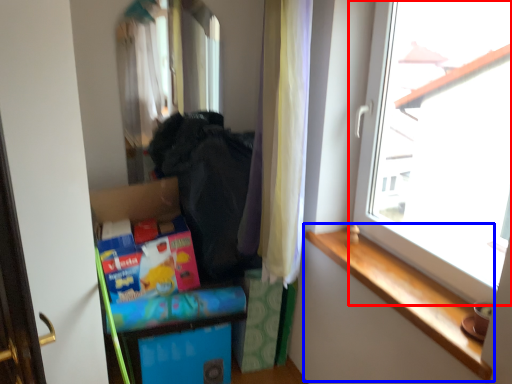
Question: Among these objects, which one is farthest to the camera, window (highlighted by a red box) or window sill (highlighted by a blue box)?

Choices:
 (A) window
 (B) window sill

Answer: (B)